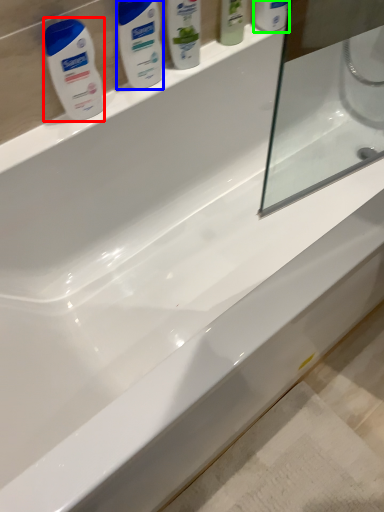
Question: Based on their relative distances, which object is farther from cleaning product (highlighted by a red box)? Choose from personal care (highlighted by a blue box) and mouthwash (highlighted by a green box).

Choices:
 (A) personal care
 (B) mouthwash

Answer: (B)